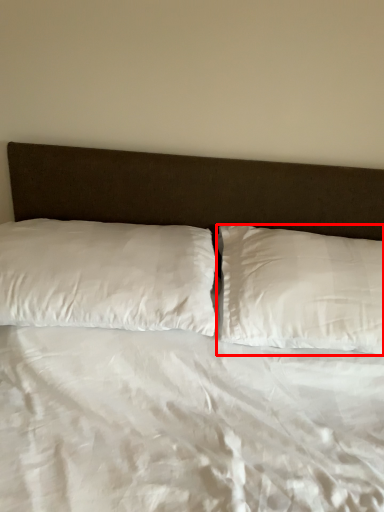
Question: Observing the image, what is the correct spatial positioning of pillow (annotated by the red box) in reference to pillow?

Choices:
 (A) left
 (B) right

Answer: (B)